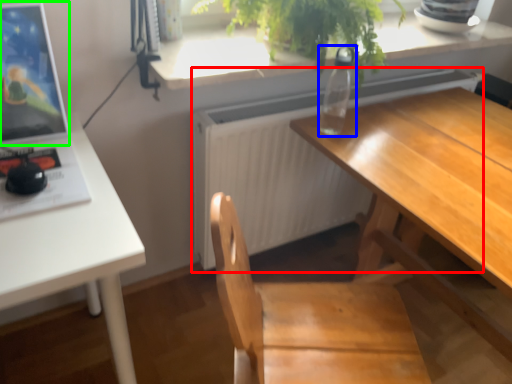
Question: Considering the real-world distances, which object is farthest from radiator (highlighted by a red box)? bottle (highlighted by a blue box) or computer monitor (highlighted by a green box)?

Choices:
 (A) bottle
 (B) computer monitor

Answer: (B)